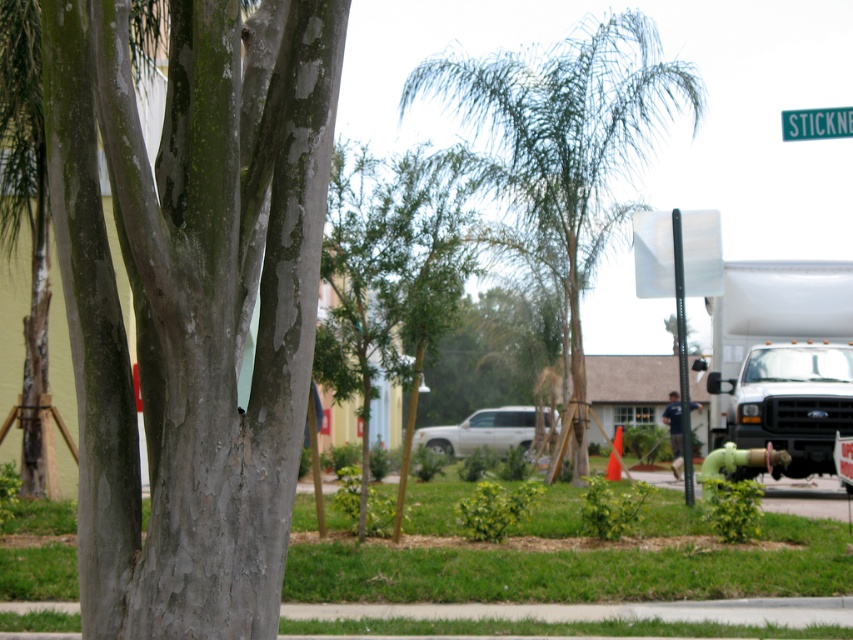
You are a painter standing in front of the tree trunk with gray textured bark at center and the black metal pole at upper right. You want to paint both objects. Which object should you step closer to in order to capture its details accurately?

The gray textured bark at center has a lesser width compared to the black metal pole at upper right, so you should step closer to the gray textured bark at center to capture its details accurately since it is smaller in width and requires closer observation.

You are a delivery driver needing to park your 5.5 meter long truck between the white matte truck at right and the white matte suv at center. Is there enough space between them for your truck?

The distance between the white matte truck at right and the white matte suv at center is 7.12 meters. Since your truck is 5.5 meters long, there is sufficient space to park between them as 7.12 meters is greater than 5.5 meters.

You are standing in front of the tree trunk shown in the scene. If you look directly at the center of the trunk, what color texture will you see at point (190, 300)?

At point (190, 300), you will see gray textured bark at center.